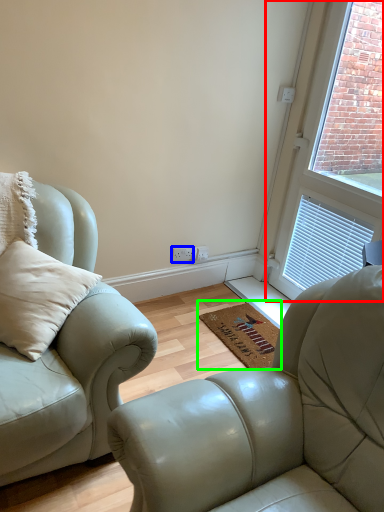
Question: Which is nearer to the window (highlighted by a red box)? electric outlet (highlighted by a blue box) or doormat (highlighted by a green box).

Choices:
 (A) electric outlet
 (B) doormat

Answer: (B)